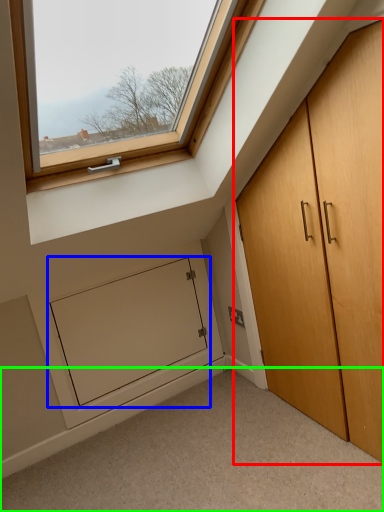
Question: Which is farther away from cupboard (highlighted by a red box)? screen door (highlighted by a blue box) or corridor (highlighted by a green box)?

Choices:
 (A) screen door
 (B) corridor

Answer: (A)